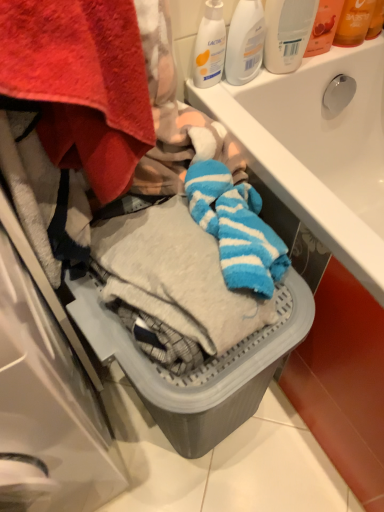
Question: In the image, is white plastic bottle at upper right, marked as the 1th cleaning product in a right-to-left arrangement, on the left side or the right side of white matte lotion at upper right, placed as the 3th cleaning product when sorted from right to left?

Choices:
 (A) left
 (B) right

Answer: (B)

Question: Considering the positions of white plastic bottle at upper right, marked as the 1th cleaning product in a right-to-left arrangement, and white matte lotion at upper right, the 1th cleaning product viewed from the left, in the image, is white plastic bottle at upper right, marked as the 1th cleaning product in a right-to-left arrangement, bigger or smaller than white matte lotion at upper right, the 1th cleaning product viewed from the left,?

Choices:
 (A) small
 (B) big

Answer: (B)

Question: Estimate the real-world distances between objects in this image. Which object is closer to the white plastic bottle at upper right, marked as the 1th cleaning product in a right-to-left arrangement?

Choices:
 (A) translucent plastic bottle at upper right, the 2th toiletry in the right-to-left sequence
 (B) white plastic bottle at upper center, the second cleaning product positioned from the left
 (C) gray plastic basket at lower center
 (D) white glossy sink at upper center
 (E) translucent orange lotion at upper right, which is the 1th toiletry in right-to-left order

Answer: (B)

Question: Which is farther from the white matte lotion at upper right, the 1th cleaning product viewed from the left?

Choices:
 (A) translucent plastic bottle at upper right, the 1th toiletry from the left
 (B) translucent orange lotion at upper right, which is the 1th toiletry in right-to-left order
 (C) white plastic bottle at upper right, placed as the third cleaning product when sorted from left to right
 (D) gray plastic basket at lower center
 (E) white glossy sink at upper center

Answer: (D)